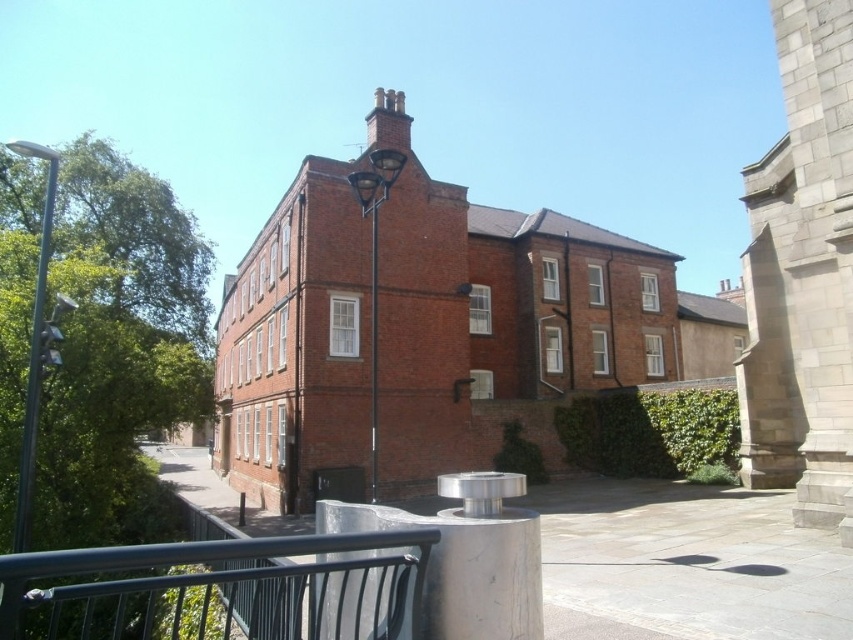
Question: Which point is farther to the camera?

Choices:
 (A) metallic silver streetlamp at center
 (B) green leafy hedge at center
 (C) black metal railing at lower left
 (D) metallic pole at left

Answer: (B)

Question: Is metallic pole at left to the left of metallic silver streetlamp at center from the viewer's perspective?

Choices:
 (A) yes
 (B) no

Answer: (A)

Question: Is black metal railing at lower left behind metallic pole at left?

Choices:
 (A) yes
 (B) no

Answer: (B)

Question: Does black metal railing at lower left have a smaller size compared to metallic pole at left?

Choices:
 (A) yes
 (B) no

Answer: (A)

Question: Which point is farther to the camera?

Choices:
 (A) (38, 376)
 (B) (363, 216)

Answer: (B)

Question: Which point is farther to the camera?

Choices:
 (A) metallic silver streetlamp at center
 (B) green leafy hedge at center
 (C) metallic pole at left
 (D) black metal railing at lower left

Answer: (B)